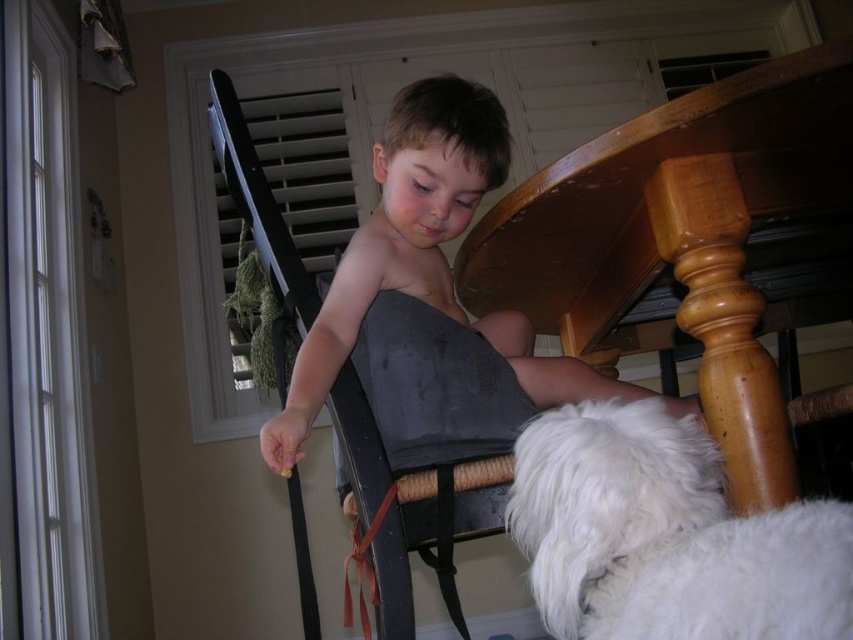
Can you confirm if wooden chair at center is shorter than red fabric strap at lower center?

No.

At what (x,y) coordinates should I click in order to perform the action: click on wooden chair at center. Please return your answer as a coordinate pair (x, y). Looking at the image, I should click on (421, 397).

Where is `wooden chair at center`? Image resolution: width=853 pixels, height=640 pixels. wooden chair at center is located at coordinates (421, 397).

From the picture: Does white fluffy dog at lower right appear on the right side of wooden chair at center?

Indeed, white fluffy dog at lower right is positioned on the right side of wooden chair at center.

The width and height of the screenshot is (853, 640). What are the coordinates of `white fluffy dog at lower right` in the screenshot? It's located at (666, 536).

Who is more forward, (715, 602) or (376, 604)?

Point (715, 602) is in front.

Which is below, white fluffy dog at lower right or red fabric strap at lower center?

Positioned lower is red fabric strap at lower center.

Is point (556, 492) positioned after point (392, 490)?

No.

The image size is (853, 640). In order to click on white fluffy dog at lower right in this screenshot , I will do `click(666, 536)`.